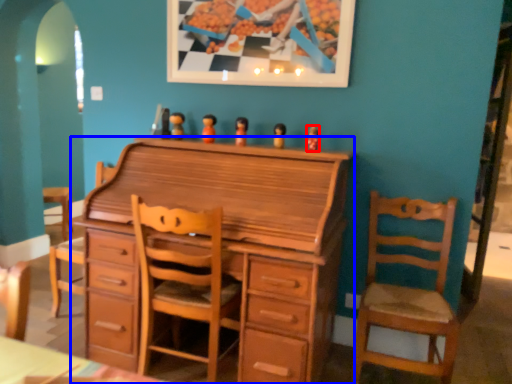
Question: Which point is further to the camera, toy (highlighted by a red box) or chest of drawers (highlighted by a blue box)?

Choices:
 (A) toy
 (B) chest of drawers

Answer: (A)